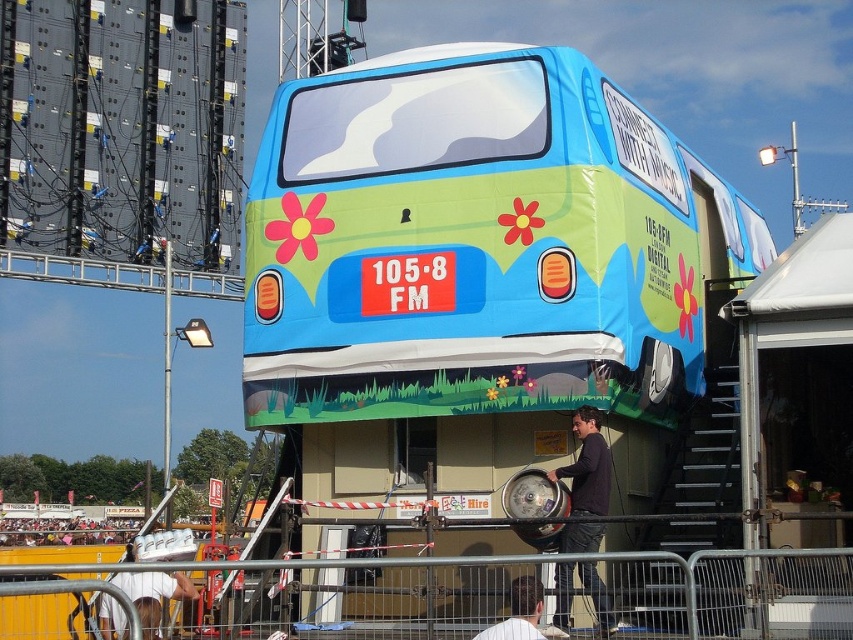
Question: Does dark brown leather jacket at lower center have a lesser width compared to white shirt at lower center?

Choices:
 (A) no
 (B) yes

Answer: (B)

Question: Which of the following is the farthest from the observer?

Choices:
 (A) white shirt at lower center
 (B) metal at lower center

Answer: (A)

Question: Among these objects, which one is farthest from the camera?

Choices:
 (A) matte blue van at center
 (B) white fabric at lower left
 (C) metal at lower center
 (D) white shirt at lower center

Answer: (A)

Question: Does metal at lower center lie in front of white shirt at lower center?

Choices:
 (A) no
 (B) yes

Answer: (B)

Question: Is metal at lower center closer to camera compared to white fabric at lower left?

Choices:
 (A) no
 (B) yes

Answer: (B)

Question: Which point is closer to the camera?

Choices:
 (A) white fabric at lower left
 (B) matte blue van at center
 (C) white shirt at lower center

Answer: (C)